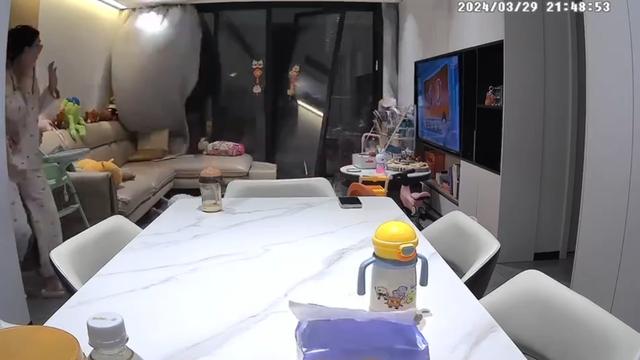
Where is `table`? The image size is (640, 360). table is located at coordinates (243, 279).